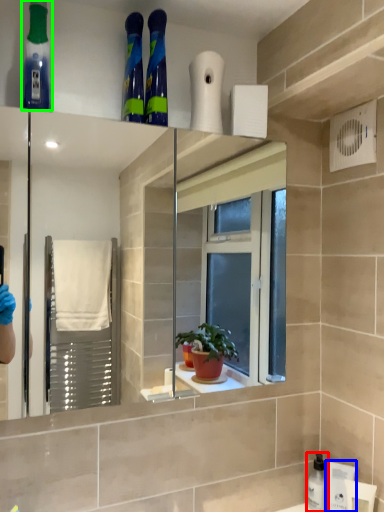
Question: Based on their relative distances, which object is farther from cleaning product (highlighted by a red box)? Choose from toiletry (highlighted by a blue box) and mouthwash (highlighted by a green box).

Choices:
 (A) toiletry
 (B) mouthwash

Answer: (B)